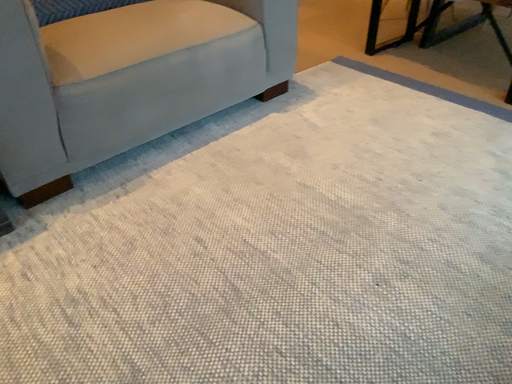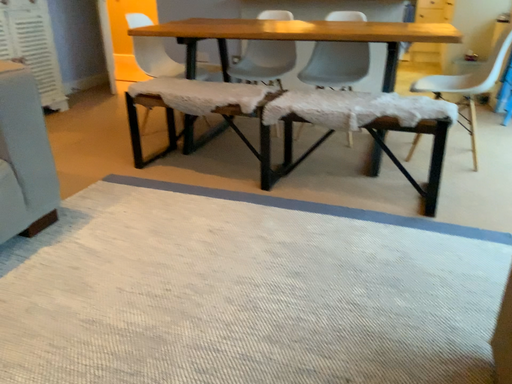
Question: How did the camera likely rotate when shooting the video?

Choices:
 (A) rotated upward
 (B) rotated downward

Answer: (A)